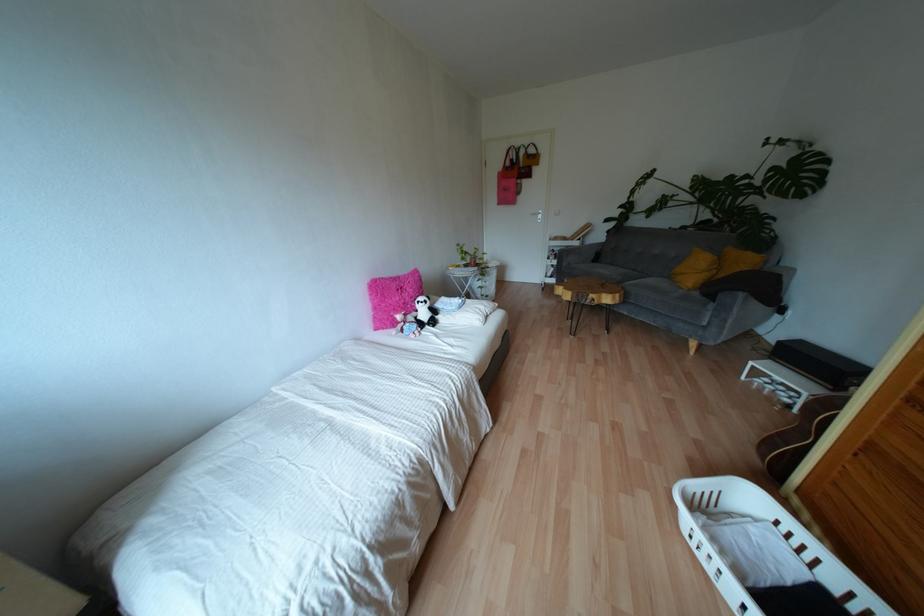
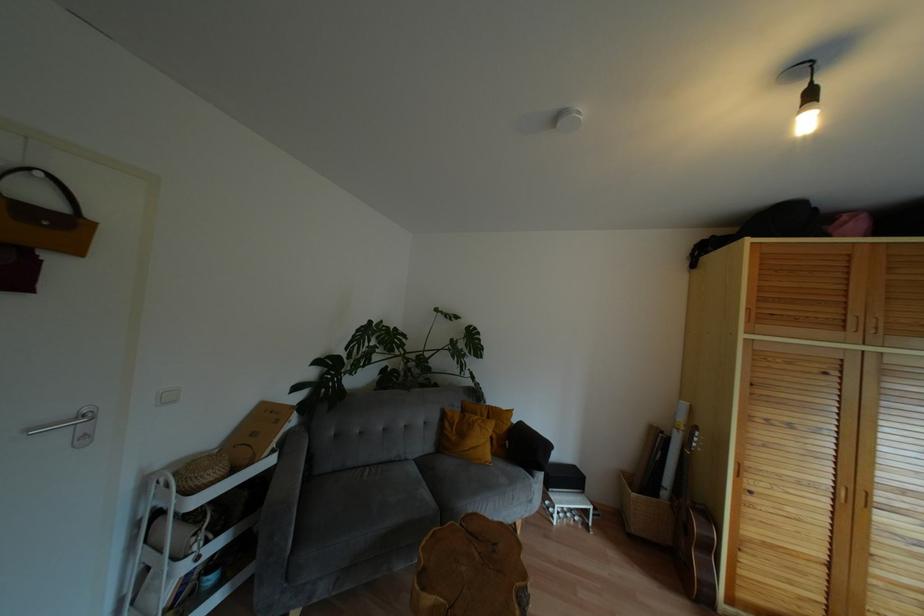
Locate, in the second image, the point that corresponds to (537,163) in the first image.

(78, 251)